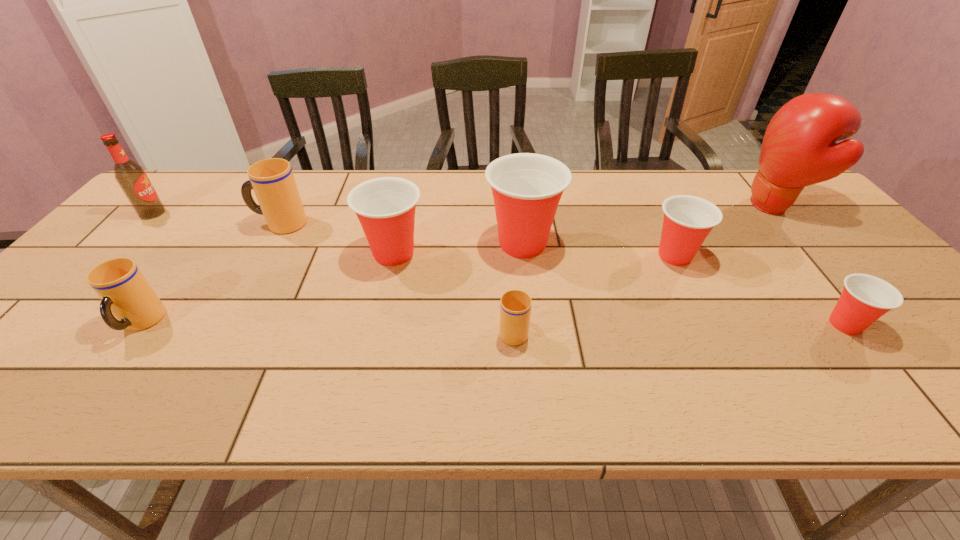
In the image, there is a desktop. Where is `blank space at the left edge`? This screenshot has width=960, height=540. blank space at the left edge is located at coordinates (175, 218).

Locate an element on the screen. This screenshot has height=540, width=960. free location at the right edge is located at coordinates (838, 238).

Find the location of `free region at the far left corner of the desktop`. free region at the far left corner of the desktop is located at coordinates (220, 172).

Locate an element on the screen. empty space that is in between the third cup from left to right and the rightmost red cup is located at coordinates (619, 289).

Identify the location of free spot between the sixth cup from left to right and the biggest red cup. (599, 249).

Identify the location of free point between the rightmost red cup and the tallest object. The height and width of the screenshot is (540, 960). point(809,266).

Where is `free space that is in between the rightmost cup and the biggest red cup`? Image resolution: width=960 pixels, height=540 pixels. free space that is in between the rightmost cup and the biggest red cup is located at coordinates pos(684,284).

Image resolution: width=960 pixels, height=540 pixels. I want to click on vacant space that's between the seventh object from left to right and the second smallest beige cup, so click(x=408, y=289).

Where is `empty space between the red boxing glove and the second object from left to right`? The height and width of the screenshot is (540, 960). empty space between the red boxing glove and the second object from left to right is located at coordinates (458, 265).

What are the coordinates of `free space that is in between the smallest beige cup and the second biggest red cup` in the screenshot? It's located at [453, 292].